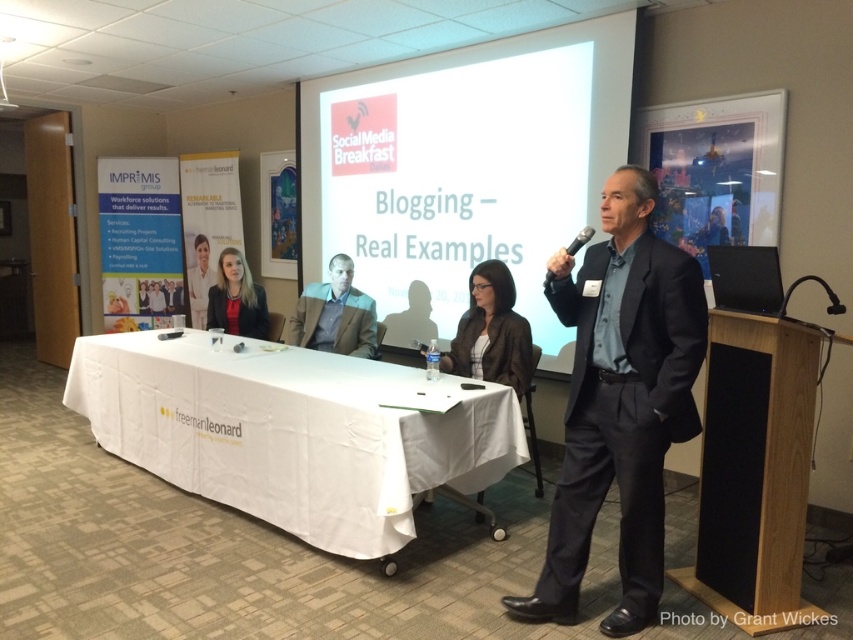
The height and width of the screenshot is (640, 853). Find the location of `brown leather jacket at center`. brown leather jacket at center is located at coordinates (335, 314).

Does point (306, 292) come in front of point (204, 241)?

Yes, point (306, 292) is in front of point (204, 241).

Does point (300, 333) come farther from viewer compared to point (196, 241)?

No, (300, 333) is in front of (196, 241).

This screenshot has height=640, width=853. I want to click on brown leather jacket at center, so click(335, 314).

Is dark blue suit at right wider than matte black suit at center?

Yes, dark blue suit at right is wider than matte black suit at center.

Who is positioned more to the right, dark blue suit at right or matte black suit at center?

From the viewer's perspective, dark blue suit at right appears more on the right side.

The width and height of the screenshot is (853, 640). Find the location of `dark blue suit at right`. dark blue suit at right is located at coordinates (619, 401).

Does dark blue suit at right appear on the left side of matte white shirt at center?

No, dark blue suit at right is not to the left of matte white shirt at center.

Can you confirm if dark blue suit at right is positioned to the right of matte white shirt at center?

Yes, dark blue suit at right is to the right of matte white shirt at center.

Is point (641, 474) farther from camera compared to point (202, 275)?

No, (641, 474) is closer to viewer.

Locate an element on the screen. dark blue suit at right is located at coordinates (619, 401).